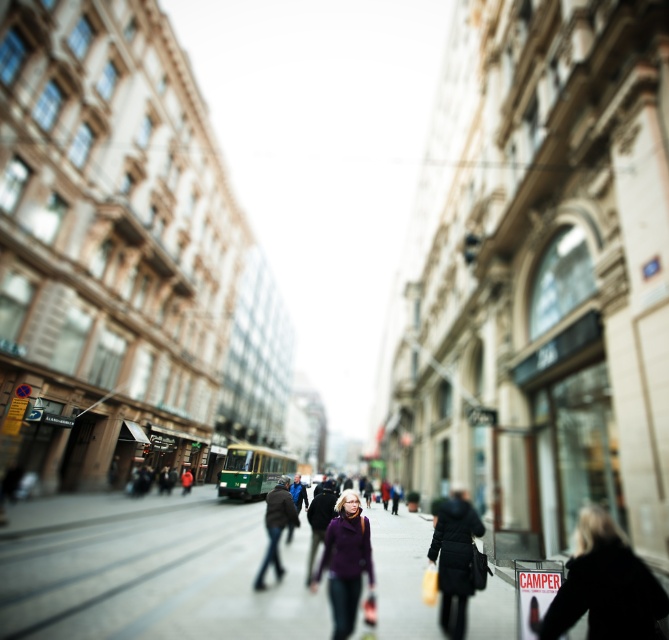
You are a photographer trying to capture a clear shot of the purple woolen sweater at center without the silhouette leather jacket at lower right blocking it. What should you do?

Move the camera backward to create more distance between the silhouette leather jacket at lower right and the purple woolen sweater at center, allowing the purple woolen sweater at center to be visible without obstruction.

You are a delivery person who needs to place a large package on the sidewalk. The package is as big as the silhouette leather jacket at lower right. Can you fit it on the smooth concrete sidewalk at center without moving anything else?

The smooth concrete sidewalk at center is larger in size than the silhouette leather jacket at lower right, so the package can fit on the smooth concrete sidewalk at center without moving anything else.

You are a delivery drone flying above the urban street scene. You need to land on the smooth concrete sidewalk at center to drop off a package. However, there is a purple woolen sweater at center in your landing path. Can you safely land on the sidewalk without disturbing the sweater?

The smooth concrete sidewalk at center is located below the purple woolen sweater at center, so you cannot safely land on the sidewalk without disturbing the sweater.